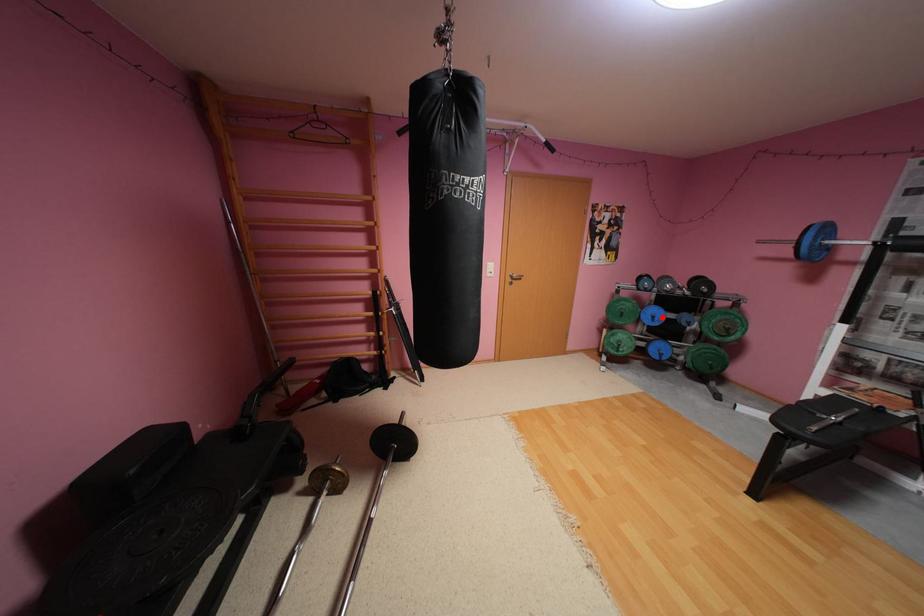
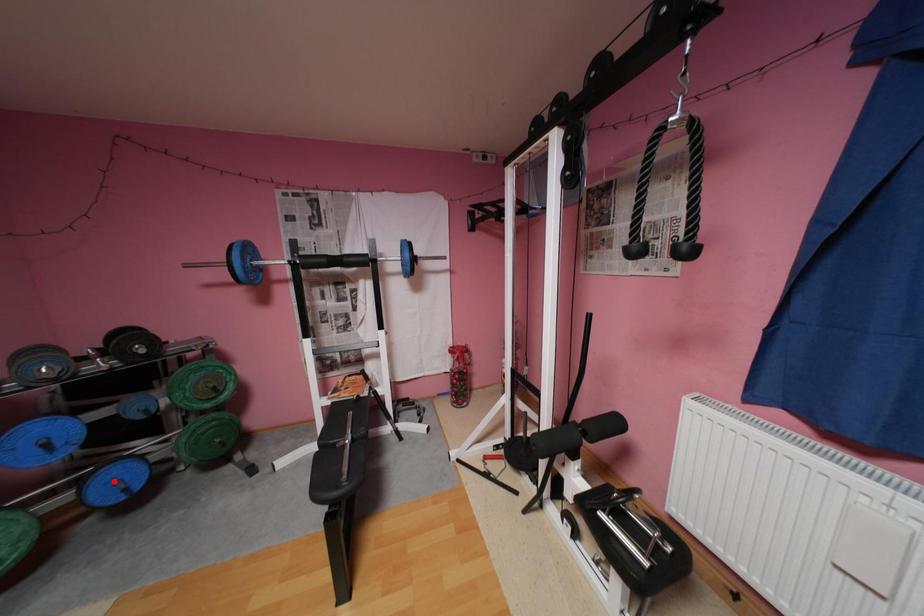
I am providing you with two images of the same scene from different viewpoints. A red point is marked on the first image and another point is marked on the second image. Is the red point in image1 aligned with the point shown in image2?

No